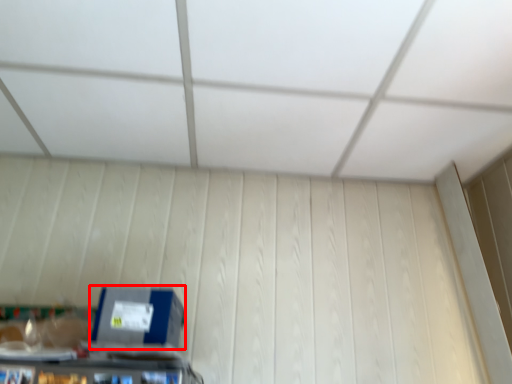
Question: In this image, where is box (annotated by the red box) located relative to exhaust hood?

Choices:
 (A) right
 (B) left

Answer: (B)